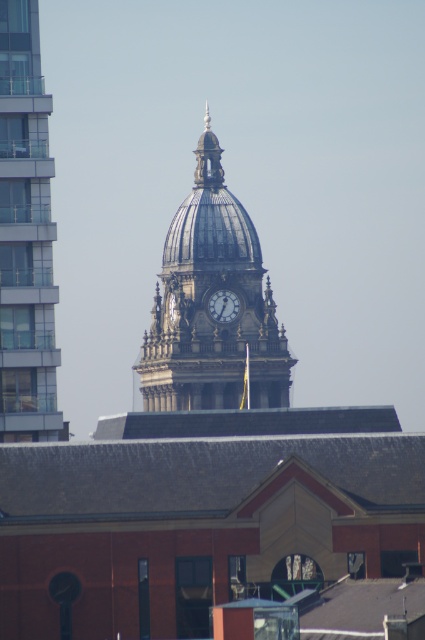
Can you confirm if shiny metallic clock tower at center is positioned below glassy steel clock tower at upper center?

Yes, shiny metallic clock tower at center is below glassy steel clock tower at upper center.

Is shiny metallic clock tower at center to the right of glassy steel clock tower at upper center from the viewer's perspective?

Correct, you'll find shiny metallic clock tower at center to the right of glassy steel clock tower at upper center.

In order to click on shiny metallic clock tower at center in this screenshot , I will do `click(207, 301)`.

Locate an element on the screen. The height and width of the screenshot is (640, 425). shiny metallic clock tower at center is located at coordinates (207, 301).

Who is taller, shiny metallic clock tower at center or matte white clock at center?

shiny metallic clock tower at center is taller.

Can you confirm if shiny metallic clock tower at center is wider than matte white clock at center?

Yes, shiny metallic clock tower at center is wider than matte white clock at center.

Is point (232, 365) farther from viewer compared to point (221, 301)?

No, (232, 365) is closer to viewer.

The height and width of the screenshot is (640, 425). I want to click on shiny metallic clock tower at center, so click(207, 301).

Is glassy steel clock tower at upper center to the right of matte white clock at center from the viewer's perspective?

No, glassy steel clock tower at upper center is not to the right of matte white clock at center.

Who is positioned more to the left, glassy steel clock tower at upper center or matte white clock at center?

From the viewer's perspective, glassy steel clock tower at upper center appears more on the left side.

Find the location of a particular element. The image size is (425, 640). glassy steel clock tower at upper center is located at coordinates (25, 236).

Locate an element on the screen. The height and width of the screenshot is (640, 425). glassy steel clock tower at upper center is located at coordinates (25, 236).